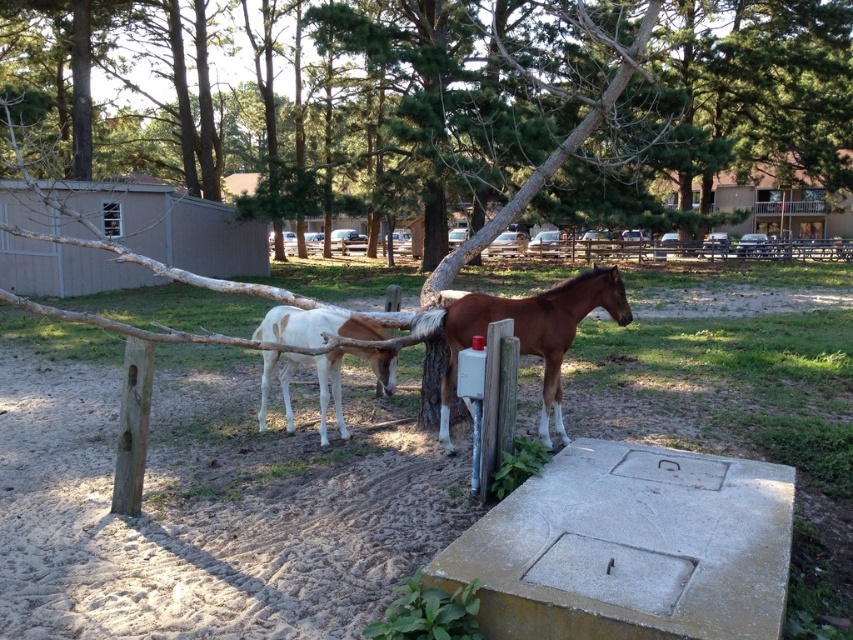
Question: Is brown glossy horse at center below brown wooden fence at center?

Choices:
 (A) yes
 (B) no

Answer: (A)

Question: Is green leafy tree at center to the right of white glossy horse at center from the viewer's perspective?

Choices:
 (A) no
 (B) yes

Answer: (B)

Question: Which of the following is the closest to the observer?

Choices:
 (A) (825, 163)
 (B) (318, 365)

Answer: (B)

Question: Based on their relative distances, which object is farther from the brown wooden fence at center?

Choices:
 (A) brown glossy horse at center
 (B) white glossy horse at center
 (C) green leafy tree at center

Answer: (A)

Question: Considering the real-world distances, which object is closest to the brown wooden fence at center?

Choices:
 (A) white glossy horse at center
 (B) green leafy tree at center
 (C) brown glossy horse at center

Answer: (B)

Question: Is green leafy tree at center below white glossy horse at center?

Choices:
 (A) yes
 (B) no

Answer: (B)